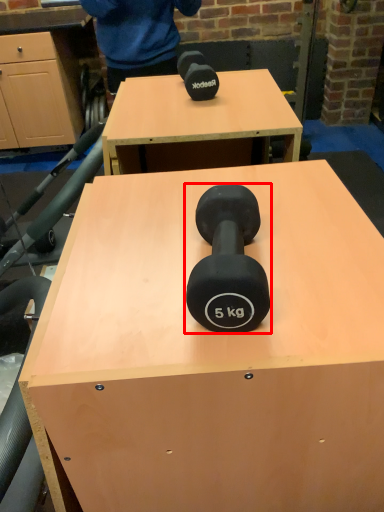
Question: From the image's perspective, considering the relative positions of dumbbell (annotated by the red box) and table in the image provided, where is dumbbell (annotated by the red box) located with respect to the staircase?

Choices:
 (A) below
 (B) above

Answer: (B)